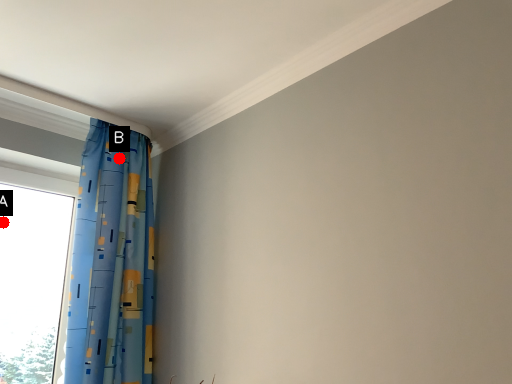
Question: Two points are circled on the image, labeled by A and B beside each circle. Which point appears closest to the camera in this image?

Choices:
 (A) A is closer
 (B) B is closer

Answer: (B)